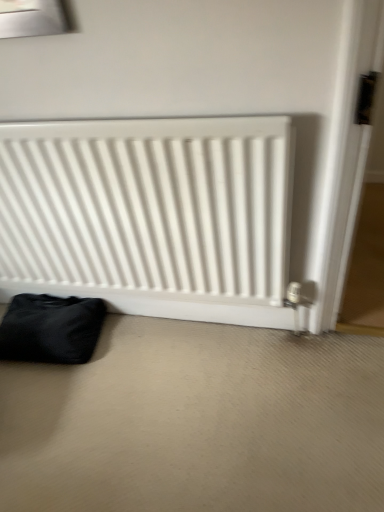
Question: Should I look upward or downward to see white matte radiator at center?

Choices:
 (A) down
 (B) up

Answer: (B)

Question: Is black fabric bag at lower left bigger than white matte radiator at center?

Choices:
 (A) yes
 (B) no

Answer: (B)

Question: Is white matte radiator at center located within black fabric bag at lower left?

Choices:
 (A) yes
 (B) no

Answer: (B)

Question: Is black fabric bag at lower left oriented away from white matte radiator at center?

Choices:
 (A) yes
 (B) no

Answer: (A)

Question: Considering the relative positions of black fabric bag at lower left and white matte radiator at center in the image provided, is black fabric bag at lower left behind white matte radiator at center?

Choices:
 (A) no
 (B) yes

Answer: (B)

Question: Can you confirm if black fabric bag at lower left is positioned to the right of white matte radiator at center?

Choices:
 (A) yes
 (B) no

Answer: (B)

Question: Can you confirm if black fabric bag at lower left is smaller than white matte radiator at center?

Choices:
 (A) no
 (B) yes

Answer: (B)

Question: Does white matte radiator at center appear on the left side of black fabric bag at lower left?

Choices:
 (A) no
 (B) yes

Answer: (A)

Question: Is white matte radiator at center smaller than black fabric bag at lower left?

Choices:
 (A) yes
 (B) no

Answer: (B)

Question: Considering the relative sizes of white matte radiator at center and black fabric bag at lower left in the image provided, is white matte radiator at center wider than black fabric bag at lower left?

Choices:
 (A) yes
 (B) no

Answer: (B)

Question: From the image's perspective, is white matte radiator at center below black fabric bag at lower left?

Choices:
 (A) yes
 (B) no

Answer: (B)

Question: Is white matte radiator at center placed right next to black fabric bag at lower left?

Choices:
 (A) no
 (B) yes

Answer: (A)

Question: From a real-world perspective, does white matte radiator at center sit lower than black fabric bag at lower left?

Choices:
 (A) no
 (B) yes

Answer: (A)

Question: Is white matte radiator at center to the left or to the right of black fabric bag at lower left in the image?

Choices:
 (A) left
 (B) right

Answer: (B)